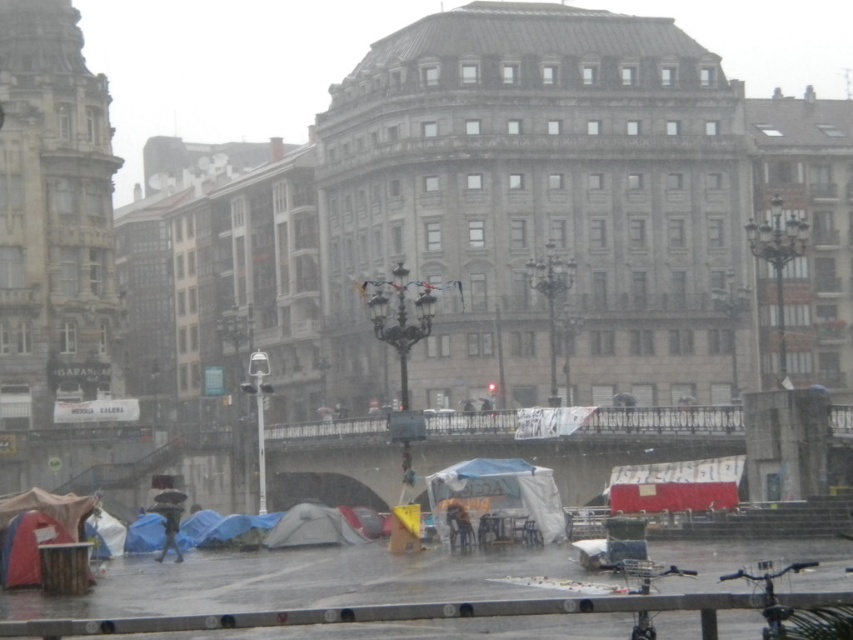
You are a delivery person who needs to deliver a package to the white canvas tent at center. The GPS coordinates provided are point 0.772, 0.585. Based on the scene description, can you confirm if this location is accessible by a delivery vehicle?

The white canvas tent at center is located at point (498, 493). Since the scene describes a wet pavement with makeshift tents set up, it is likely that the area around the white canvas tent at center is not paved or stable enough for a delivery vehicle. Therefore, the delivery vehicle may not be able to access this location.

You are standing at the point marked as point (312, 528) in the image. What object is exactly at your current position?

The gray fabric tent at lower center is exactly at point (312, 528).

You are a delivery person trying to navigate through the rainy area. You see the gray fabric tent at lower center and the blue tarp at lower left. Which object is positioned higher relative to the other?

The gray fabric tent at lower center is above the blue tarp at lower left, so it is positioned higher.